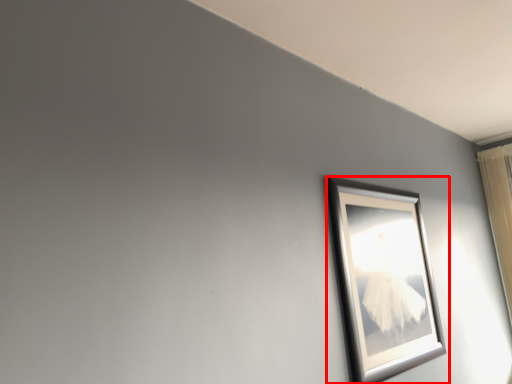
Question: From the image, what is the correct spatial relationship of picture frame (annotated by the red box) in relation to curtain?

Choices:
 (A) left
 (B) right

Answer: (A)